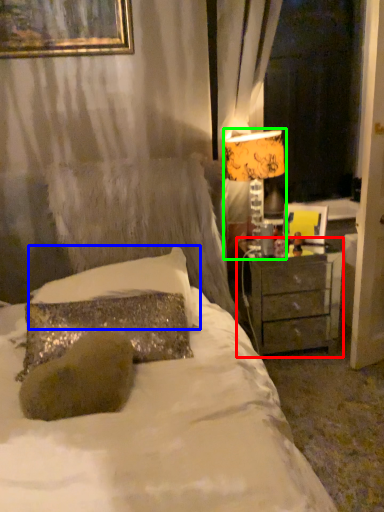
Question: Which object is positioned closest to nightstand (highlighted by a red box)? Select from pillow (highlighted by a blue box) and table lamp (highlighted by a green box).

Choices:
 (A) pillow
 (B) table lamp

Answer: (B)